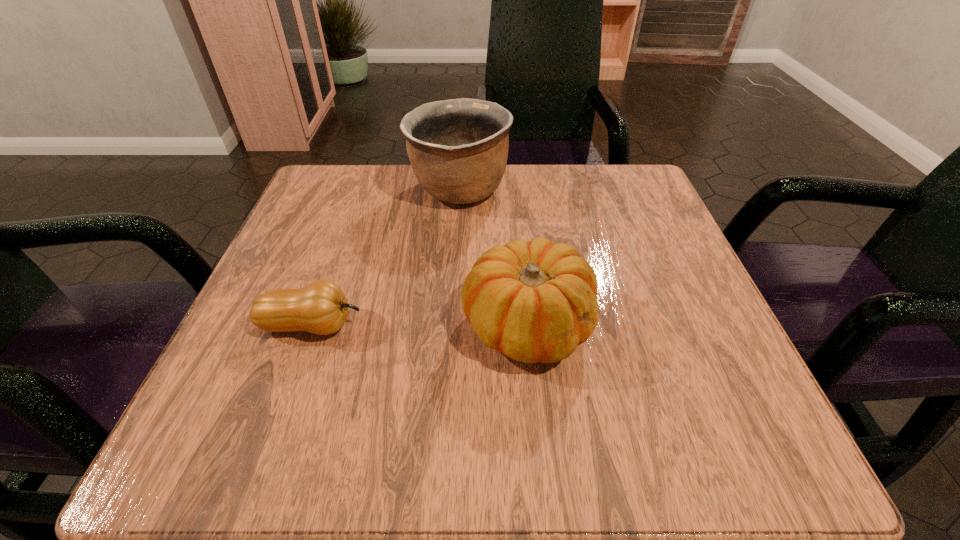
Find the location of a particular element. The width and height of the screenshot is (960, 540). object that is at the left edge is located at coordinates (321, 307).

At what (x,y) coordinates should I click in order to perform the action: click on vacant region at the far edge of the desktop. Please return your answer as a coordinate pair (x, y). Looking at the image, I should click on (393, 166).

In the image, there is a desktop. What are the coordinates of `blank space at the left edge` in the screenshot? It's located at click(317, 279).

Locate an element on the screen. vacant space at the right edge of the desktop is located at coordinates (666, 308).

Identify the location of vacant region at the far left corner of the desktop. (332, 174).

Locate an element on the screen. vacant space at the far right corner of the desktop is located at coordinates (612, 214).

Where is `free area in between the leftmost object and the pottery`? free area in between the leftmost object and the pottery is located at coordinates (386, 258).

This screenshot has width=960, height=540. What are the coordinates of `free space between the shorter gourd and the pottery` in the screenshot? It's located at (386, 258).

Image resolution: width=960 pixels, height=540 pixels. Identify the location of empty space between the pottery and the shortest object. (386, 258).

Where is `object that is the nearest to the pottery`? The height and width of the screenshot is (540, 960). object that is the nearest to the pottery is located at coordinates (535, 301).